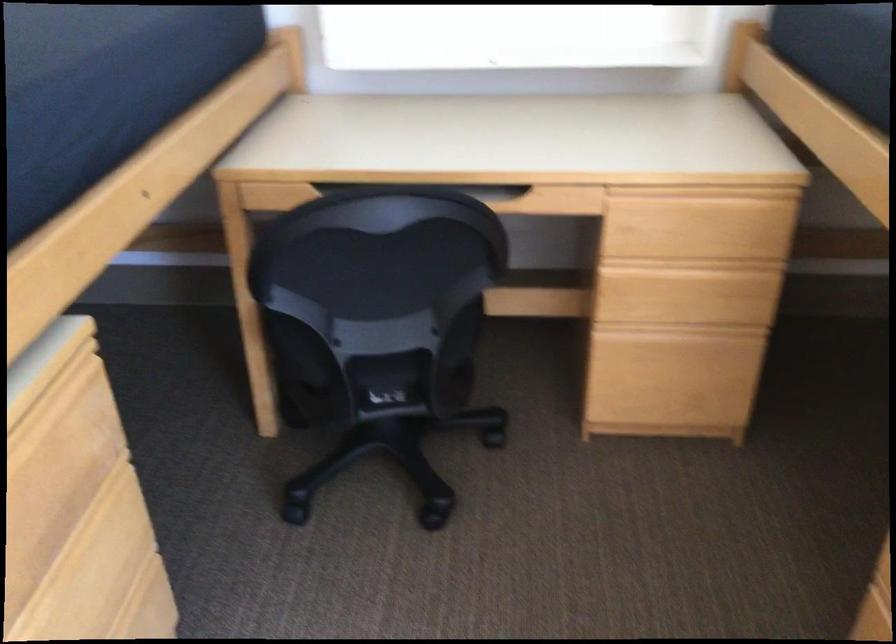
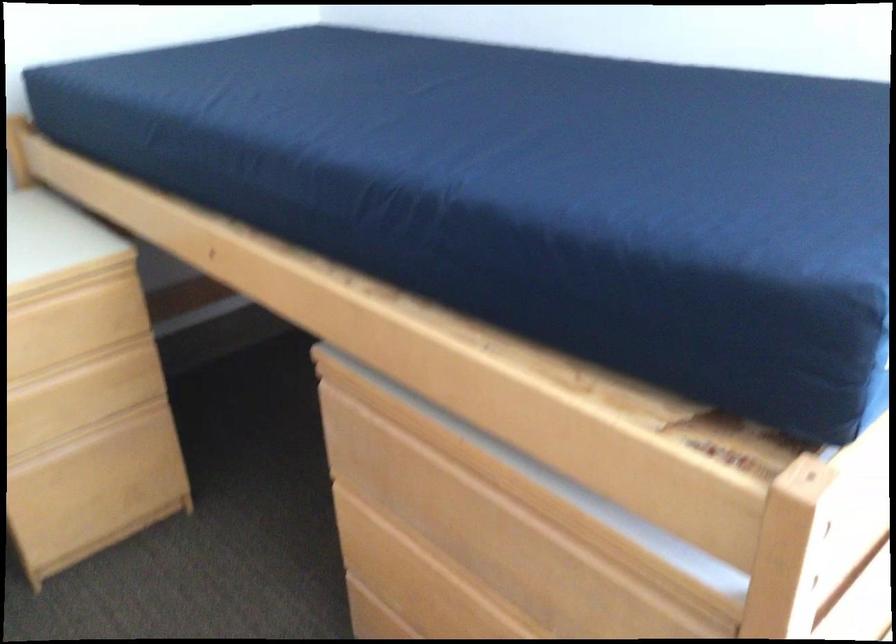
The point at (713, 220) is marked in the first image. Where is the corresponding point in the second image?

(73, 323)